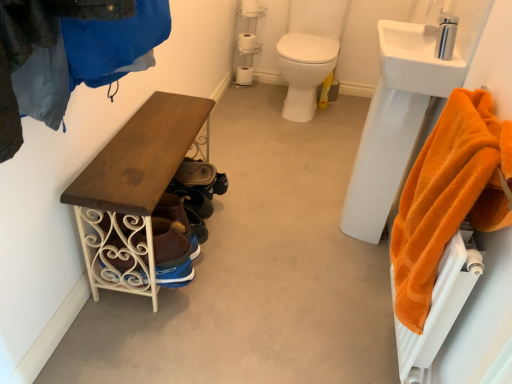
Locate an element on the screen. The image size is (512, 384). free space between white matte toilet paper at center, marked as the first toilet paper in a bottom-to-top arrangement, and white glossy toilet at center is located at coordinates (257, 93).